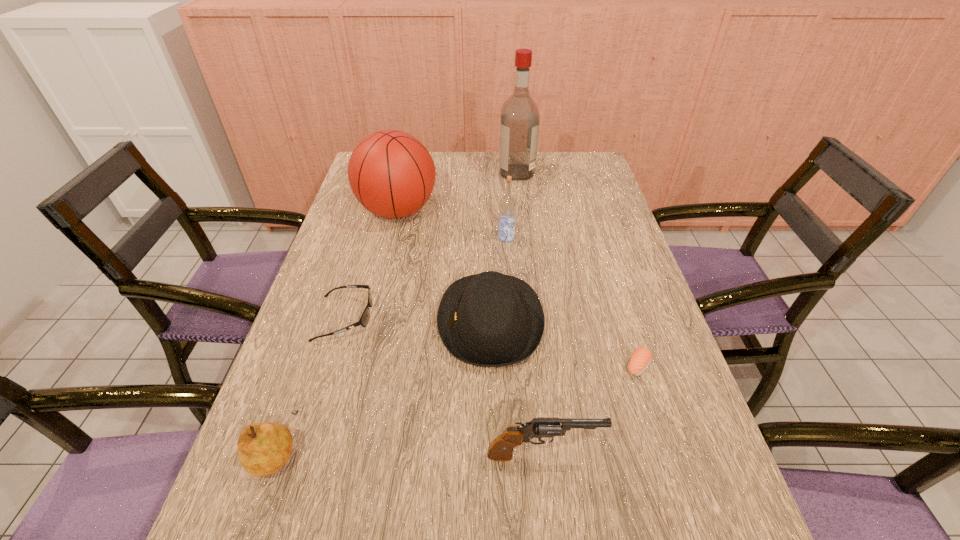
Identify the location of the tallest object. Image resolution: width=960 pixels, height=540 pixels. (519, 124).

Find the location of a particular element. This screenshot has width=960, height=540. liquor is located at coordinates (519, 124).

Where is `the seventh shortest object`? The width and height of the screenshot is (960, 540). the seventh shortest object is located at coordinates (391, 173).

Find the location of a particular element. This screenshot has width=960, height=540. the sixth shortest object is located at coordinates (507, 204).

You are a GUI agent. You are given a task and a screenshot of the screen. Output one action in this format:
    pyautogui.click(x=<x>, y=<y>)
    Task: Click on the gun
    This screenshot has height=540, width=960.
    Given the screenshot: What is the action you would take?
    pyautogui.click(x=501, y=448)

Image resolution: width=960 pixels, height=540 pixels. Identify the location of fedora. (490, 319).

Locate an element on the screen. The width and height of the screenshot is (960, 540). pear is located at coordinates (263, 448).

Image resolution: width=960 pixels, height=540 pixels. I want to click on sunglasses, so click(364, 319).

What are the coordinates of `the shortest object` in the screenshot? It's located at (641, 358).

This screenshot has width=960, height=540. Identify the location of the rightmost object. (641, 358).